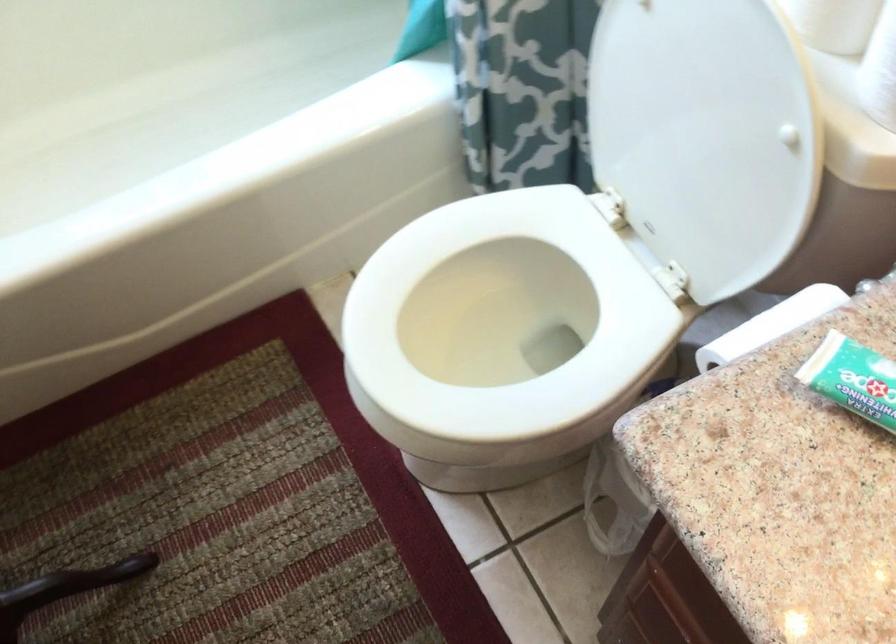
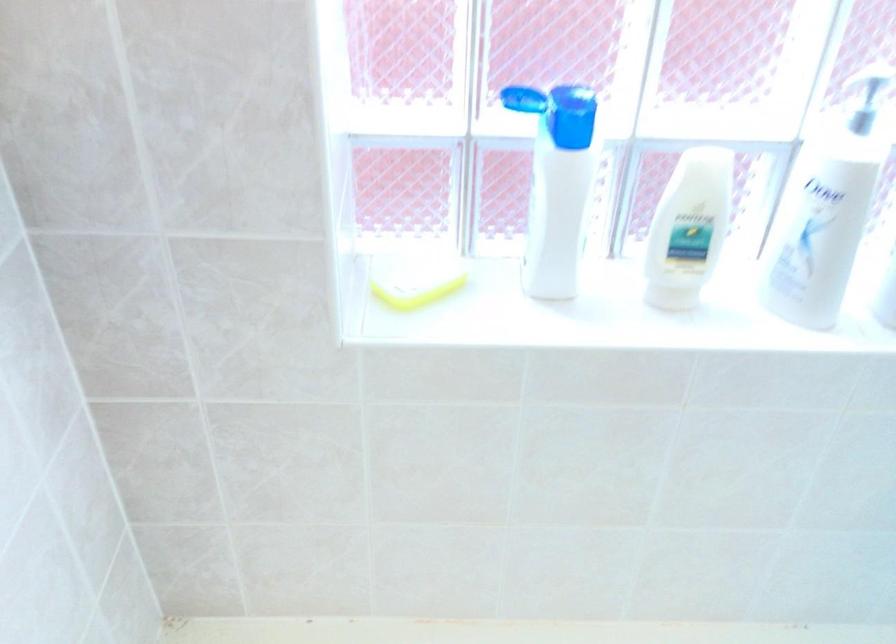
Based on the continuous images, in which direction is the camera rotating?

The rotation direction of the camera is left-up.